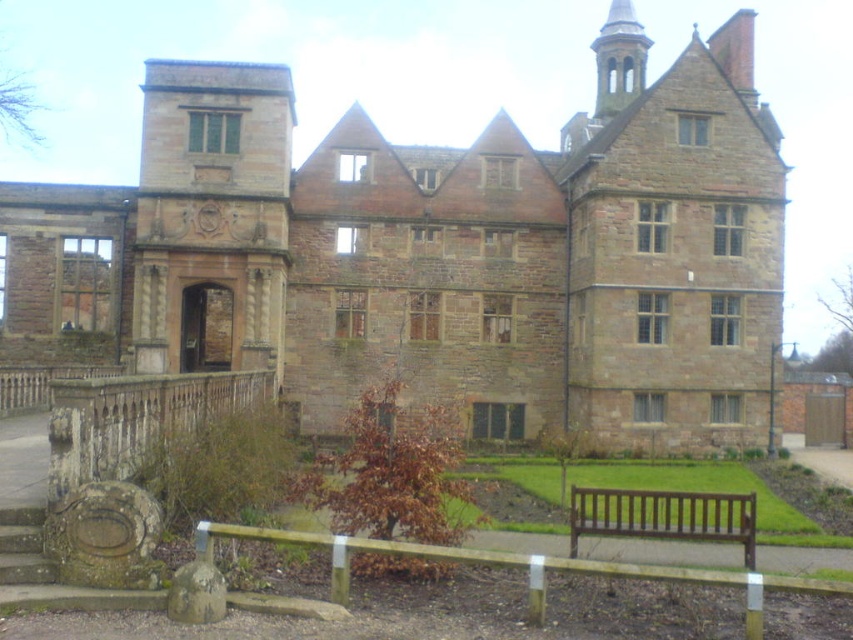
You are a visitor standing in front of the brown stone mansion at center and the brown wooden bench at lower center. Which object is taller?

The brown stone mansion at center is taller than the brown wooden bench at lower center.

Consider the image. You are standing in front of a historic stone building. A point marked at coordinates (444,252) is labeled as part of the brown stone mansion at center. Based on the scene description, what does this point likely represent on the building?

The point at (444,252) indicates the brown stone mansion at center, which is the main structure of the historic building described, likely marking its central entrance or a prominent architectural feature like a gable or dormer window.